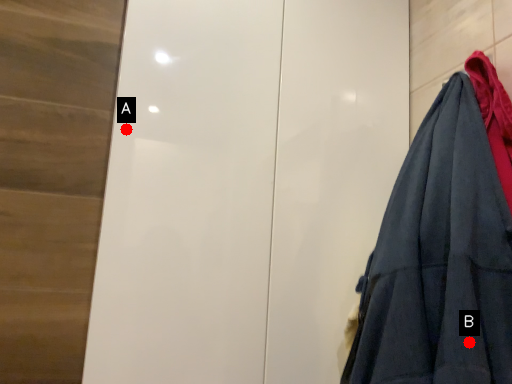
Question: Two points are circled on the image, labeled by A and B beside each circle. Which of the following is the closest to the observer?

Choices:
 (A) A is closer
 (B) B is closer

Answer: (B)